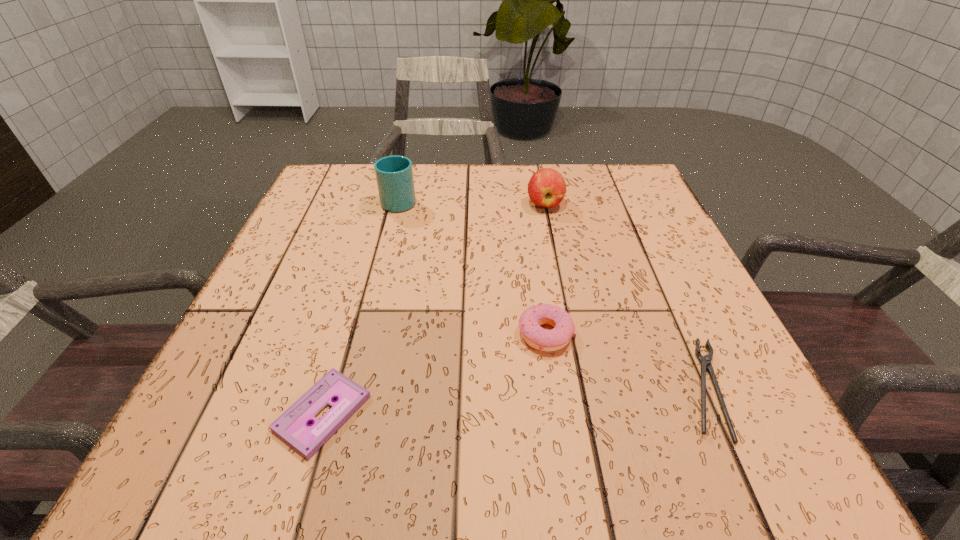
Image resolution: width=960 pixels, height=540 pixels. I want to click on the tallest object, so click(394, 174).

I want to click on apple, so pos(546,188).

Image resolution: width=960 pixels, height=540 pixels. Identify the location of the third shortest object. (534, 335).

Locate an element on the screen. tongs is located at coordinates (x=705, y=361).

Find the location of `the rightmost object`. the rightmost object is located at coordinates (705, 361).

Identify the location of the shortest object. The height and width of the screenshot is (540, 960). (292, 426).

You are a GUI agent. You are given a task and a screenshot of the screen. Output one action in this format:
    pyautogui.click(x=<x>, y=<y>)
    Task: Click on the vacant space located 0.050m on the handle side of the tallest object
    The height and width of the screenshot is (540, 960).
    Given the screenshot: What is the action you would take?
    pyautogui.click(x=405, y=179)

In order to click on free space located on the front of the apple in this screenshot , I will do `click(549, 227)`.

This screenshot has width=960, height=540. Find the location of `vacant area situated 0.230m on the right of the third tallest object`. vacant area situated 0.230m on the right of the third tallest object is located at coordinates (702, 334).

Where is `vacant space positioned 0.200m on the left of the second shortest object`? This screenshot has height=540, width=960. vacant space positioned 0.200m on the left of the second shortest object is located at coordinates (556, 389).